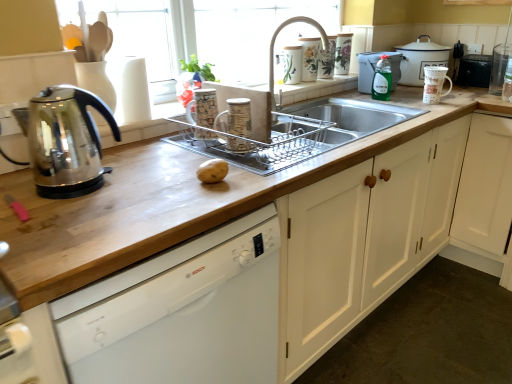
This screenshot has height=384, width=512. I want to click on vacant area located to the right-hand side of brown matte potato at center, so tap(274, 165).